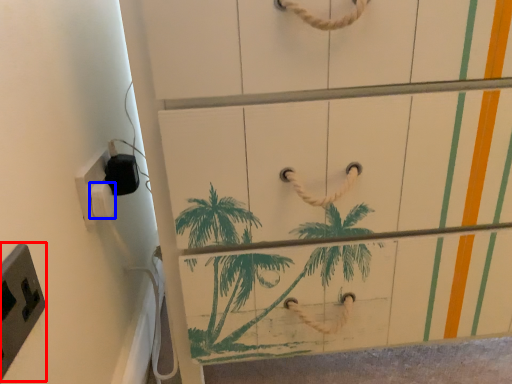
Question: Which object is closer to the camera taking this photo, light switch (highlighted by a red box) or light switch (highlighted by a blue box)?

Choices:
 (A) light switch
 (B) light switch

Answer: (A)